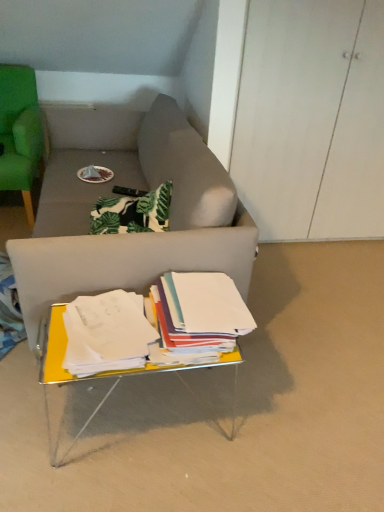
Question: Can you confirm if white paper at center, placed as the 2th paperback book when sorted from right to left, is smaller than green fabric chair at left?

Choices:
 (A) no
 (B) yes

Answer: (B)

Question: Is white paper at center, placed as the 2th paperback book when sorted from right to left, not within green fabric chair at left?

Choices:
 (A) no
 (B) yes

Answer: (B)

Question: Is white paper at center, placed as the 1th paperback book when sorted from left to right, not close to green fabric chair at left?

Choices:
 (A) yes
 (B) no

Answer: (A)

Question: Can you confirm if white paper at center, placed as the 2th paperback book when sorted from right to left, is bigger than green fabric chair at left?

Choices:
 (A) yes
 (B) no

Answer: (B)

Question: Is white paper at center, placed as the 1th paperback book when sorted from left to right, oriented away from green fabric chair at left?

Choices:
 (A) no
 (B) yes

Answer: (B)

Question: Is white paper at center, placed as the 2th paperback book when sorted from right to left, beside green fabric chair at left?

Choices:
 (A) yes
 (B) no

Answer: (B)

Question: Considering the relative sizes of white paper at center, marked as the first paperback book in a right-to-left arrangement, and white paper at center, placed as the 2th paperback book when sorted from right to left, in the image provided, is white paper at center, marked as the first paperback book in a right-to-left arrangement, shorter than white paper at center, placed as the 2th paperback book when sorted from right to left,?

Choices:
 (A) no
 (B) yes

Answer: (A)

Question: From a real-world perspective, is white paper at center, marked as the first paperback book in a right-to-left arrangement, over white paper at center, placed as the 1th paperback book when sorted from left to right?

Choices:
 (A) yes
 (B) no

Answer: (A)

Question: Considering the relative sizes of white paper at center, the second paperback book in the left-to-right sequence, and white paper at center, placed as the 1th paperback book when sorted from left to right, in the image provided, is white paper at center, the second paperback book in the left-to-right sequence, taller than white paper at center, placed as the 1th paperback book when sorted from left to right,?

Choices:
 (A) yes
 (B) no

Answer: (A)

Question: Could you tell me if white paper at center, marked as the first paperback book in a right-to-left arrangement, is facing white paper at center, placed as the 2th paperback book when sorted from right to left?

Choices:
 (A) no
 (B) yes

Answer: (A)

Question: Is white paper at center, marked as the first paperback book in a right-to-left arrangement, positioned in front of white paper at center, placed as the 2th paperback book when sorted from right to left?

Choices:
 (A) yes
 (B) no

Answer: (B)

Question: Are white paper at center, marked as the first paperback book in a right-to-left arrangement, and white paper at center, placed as the 2th paperback book when sorted from right to left, located far from each other?

Choices:
 (A) no
 (B) yes

Answer: (A)

Question: Could you tell me if green fabric chair at left is turned towards yellow metallic table at lower center?

Choices:
 (A) yes
 (B) no

Answer: (B)